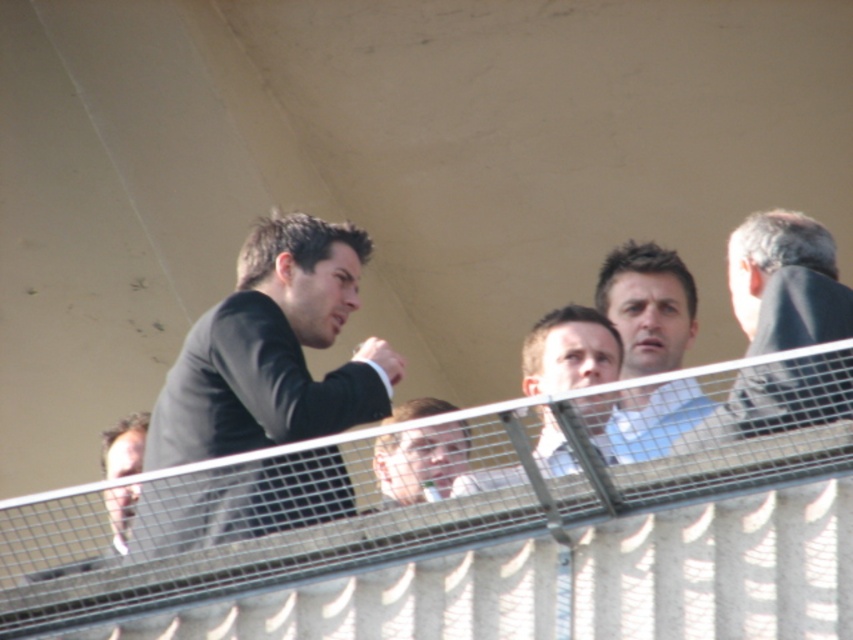
You are standing at the covered structure and want to move from point A to point B. Point A is at coordinate point (664, 339) and point B is at coordinate point (416, 416). Which point is closer to you when you start moving?

Point A at coordinate point (664, 339) is closer to you than point B at coordinate point (416, 416) because it is further to the viewer, meaning it is nearer in the scene.